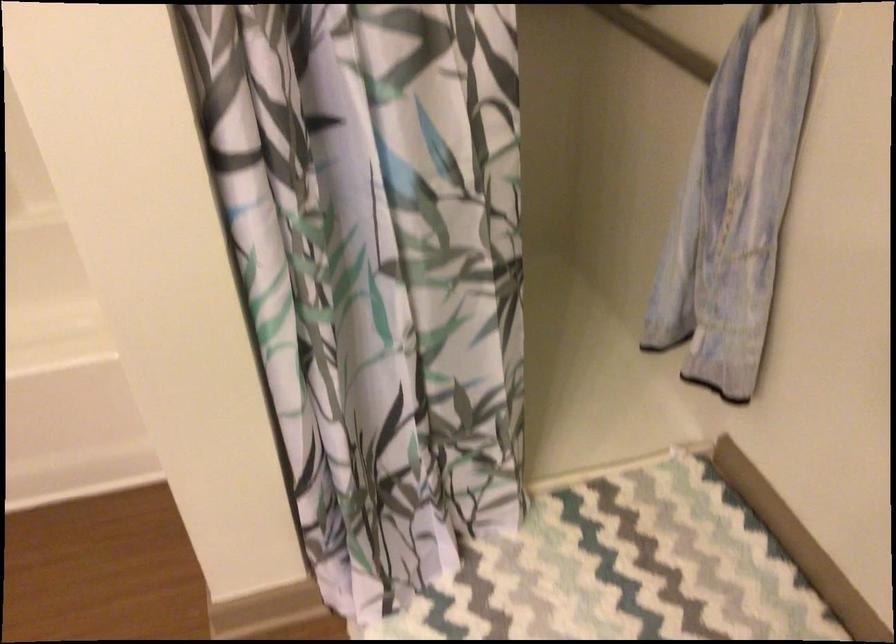
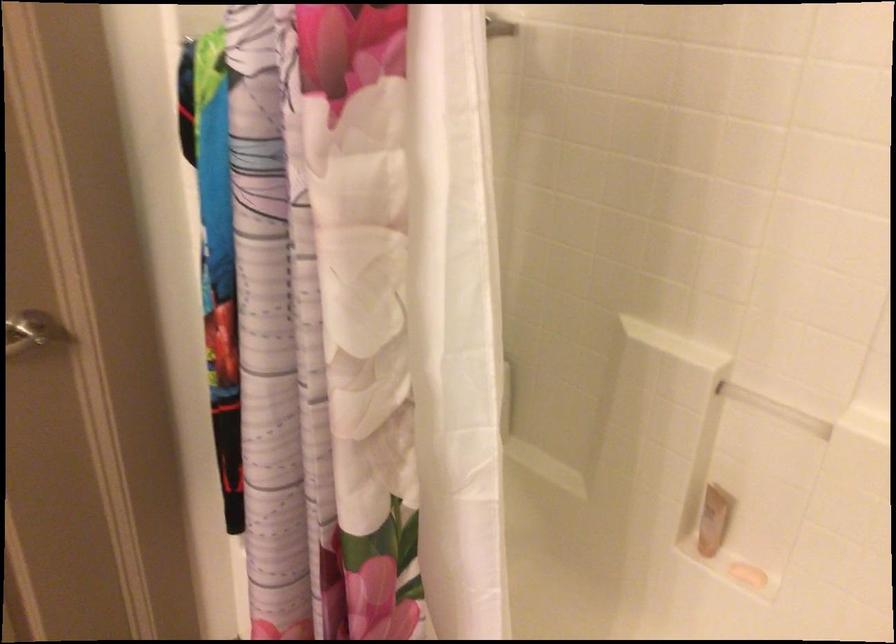
Question: The first image is from the beginning of the video and the second image is from the end. How did the camera likely rotate when shooting the video?

Choices:
 (A) Left
 (B) Right
 (C) Up
 (D) Down

Answer: (A)